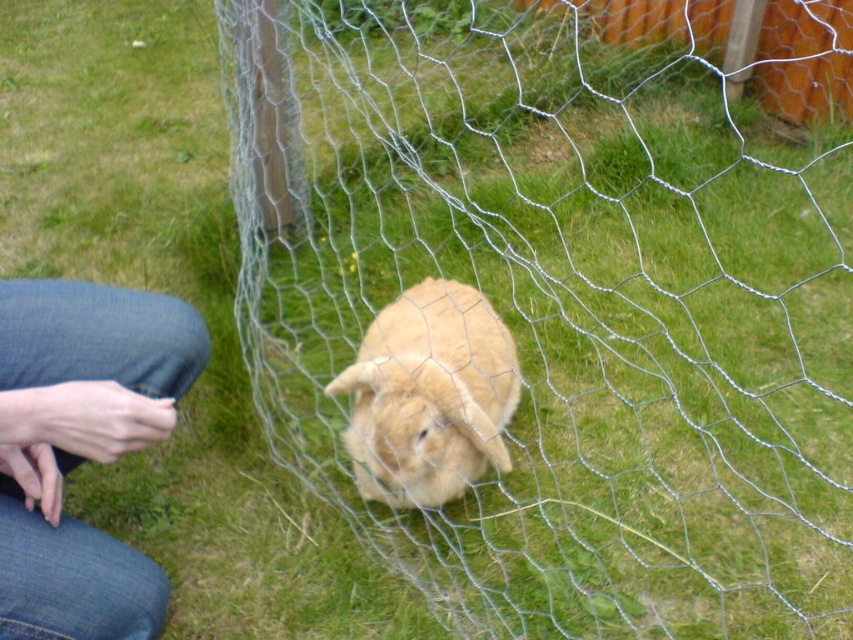
At what (x,y) coordinates should I click in order to perform the action: click on wire mesh fence at center. Please return your answer as a coordinate pair (x, y). Looking at the image, I should click on (549, 310).

Who is taller, wire mesh fence at center or blue denim jeans at lower left?

wire mesh fence at center

Locate an element on the screen. The width and height of the screenshot is (853, 640). wire mesh fence at center is located at coordinates [x=549, y=310].

Who is positioned more to the left, blue denim jeans at lower left or fuzzy beige rabbit at center?

blue denim jeans at lower left

Does blue denim jeans at lower left have a lesser height compared to fuzzy beige rabbit at center?

No, blue denim jeans at lower left is not shorter than fuzzy beige rabbit at center.

Who is more forward, (158, 401) or (422, 317)?

Point (158, 401) is in front.

At what (x,y) coordinates should I click in order to perform the action: click on blue denim jeans at lower left. Please return your answer as a coordinate pair (x, y). Image resolution: width=853 pixels, height=640 pixels. Looking at the image, I should click on (82, 448).

Describe the element at coordinates (549, 310) in the screenshot. I see `wire mesh fence at center` at that location.

Can you confirm if wire mesh fence at center is bigger than fuzzy beige rabbit at center?

Yes.

Is point (262, 122) positioned before point (393, 502)?

That is False.

The image size is (853, 640). What are the coordinates of `wire mesh fence at center` in the screenshot? It's located at (549, 310).